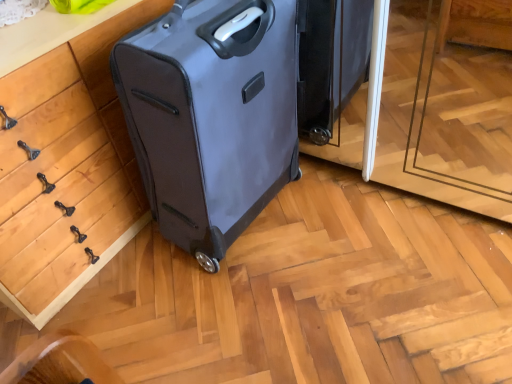
Question: From their relative heights in the image, would you say wooden drawer at left is taller or shorter than matte black suitcase at center?

Choices:
 (A) tall
 (B) short

Answer: (B)

Question: Based on their sizes in the image, would you say wooden drawer at left is bigger or smaller than matte black suitcase at center?

Choices:
 (A) small
 (B) big

Answer: (B)

Question: From a real-world perspective, is wooden drawer at left positioned above or below matte black suitcase at center?

Choices:
 (A) below
 (B) above

Answer: (A)

Question: From their relative heights in the image, would you say matte black suitcase at center is taller or shorter than wooden drawer at left?

Choices:
 (A) tall
 (B) short

Answer: (A)

Question: From a real-world perspective, is matte black suitcase at center physically located above or below wooden drawer at left?

Choices:
 (A) below
 (B) above

Answer: (B)

Question: Looking at their shapes, would you say matte black suitcase at center is wider or thinner than wooden drawer at left?

Choices:
 (A) wide
 (B) thin

Answer: (B)

Question: In the image, is matte black suitcase at center positioned in front of or behind wooden drawer at left?

Choices:
 (A) behind
 (B) front

Answer: (A)